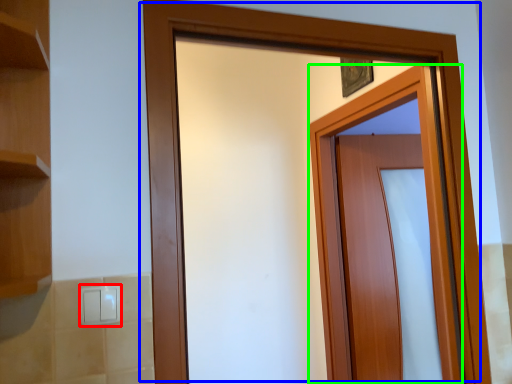
Question: Which object is the farthest from light switch (highlighted by a red box)? Choose among these: door (highlighted by a blue box) or door (highlighted by a green box).

Choices:
 (A) door
 (B) door

Answer: (B)